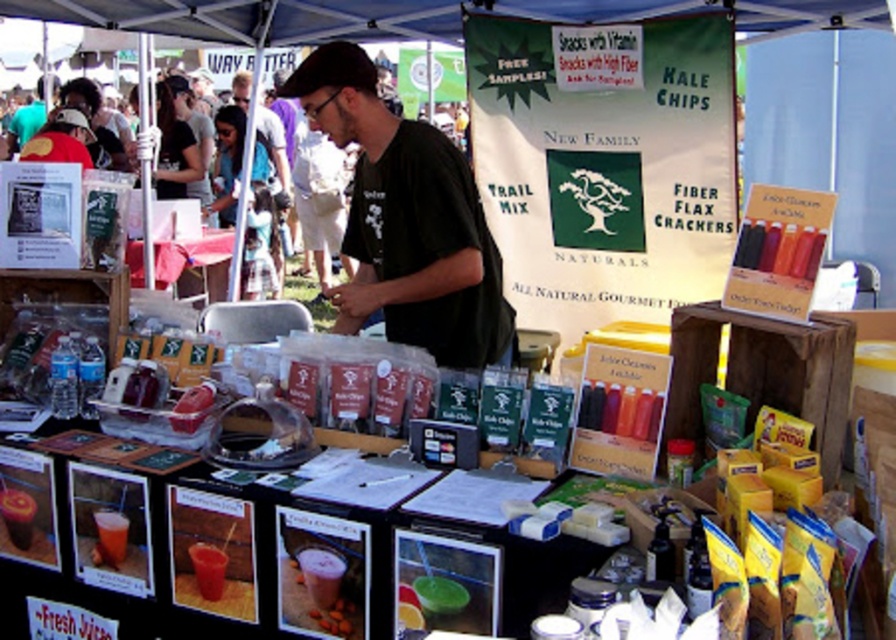
How far apart are black matte shirt at center and matte plastic table at center?

black matte shirt at center is 3.33 meters away from matte plastic table at center.

Is black matte shirt at center further to camera compared to matte plastic table at center?

That is False.

At what (x,y) coordinates should I click in order to perform the action: click on black matte shirt at center. Please return your answer as a coordinate pair (x, y). This screenshot has height=640, width=896. Looking at the image, I should click on (407, 220).